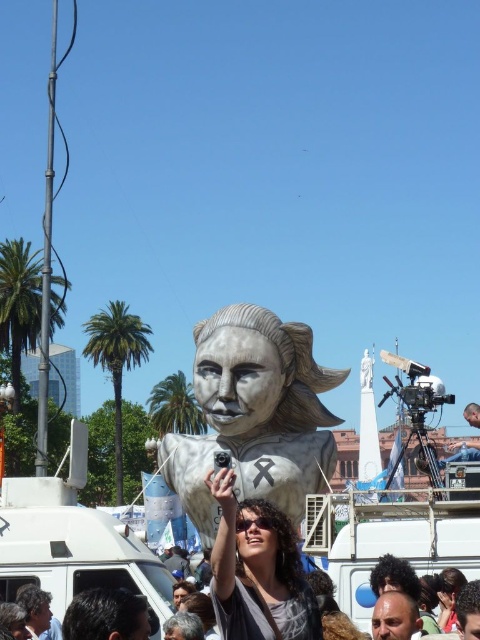
In order to click on matte gray statue at center in this screenshot , I will do `click(396, 541)`.

Is matte gray statue at center closer to camera compared to matte silver statue at center?

No, matte gray statue at center is behind matte silver statue at center.

Is point (62, 545) positioned behind point (264, 525)?

That is True.

Locate an element on the screen. This screenshot has height=640, width=480. matte gray statue at center is located at coordinates (396, 541).

Which of these two, white glossy statue at center or matte silver statue at center, stands shorter?

Standing shorter between the two is matte silver statue at center.

Does white glossy statue at center have a lesser width compared to matte silver statue at center?

Incorrect, white glossy statue at center's width is not less than matte silver statue at center's.

Identify the location of white glossy statue at center. (254, 416).

Locate an element on the screen. white glossy statue at center is located at coordinates (254, 416).

Which is below, white glossy statue at center or matte gray statue at center?

Positioned lower is matte gray statue at center.

What are the coordinates of `white glossy statue at center` in the screenshot? It's located at (254, 416).

I want to click on white glossy statue at center, so pos(254,416).